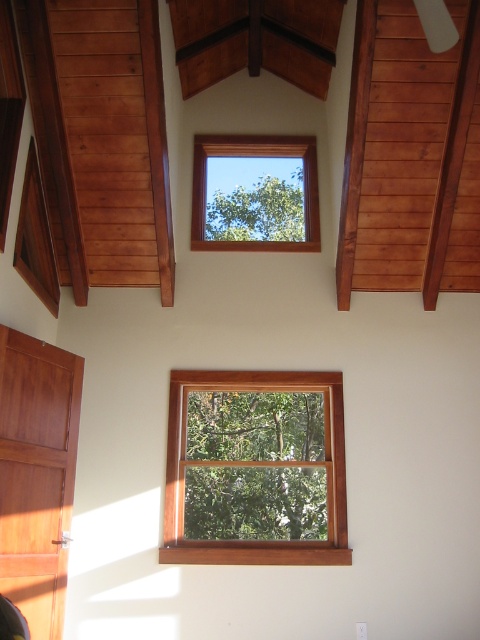
Is point (334, 438) positioned after point (302, 237)?

No, it is in front of (302, 237).

From the picture: Who is more forward, (235, 522) or (215, 195)?

Positioned in front is point (235, 522).

Identify the location of wooden frame at center. The height and width of the screenshot is (640, 480). (255, 468).